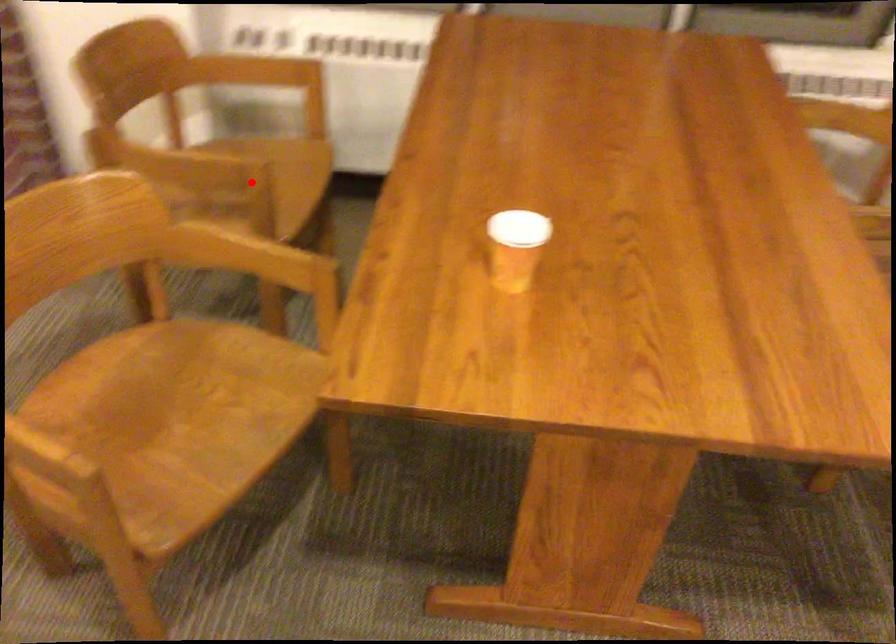
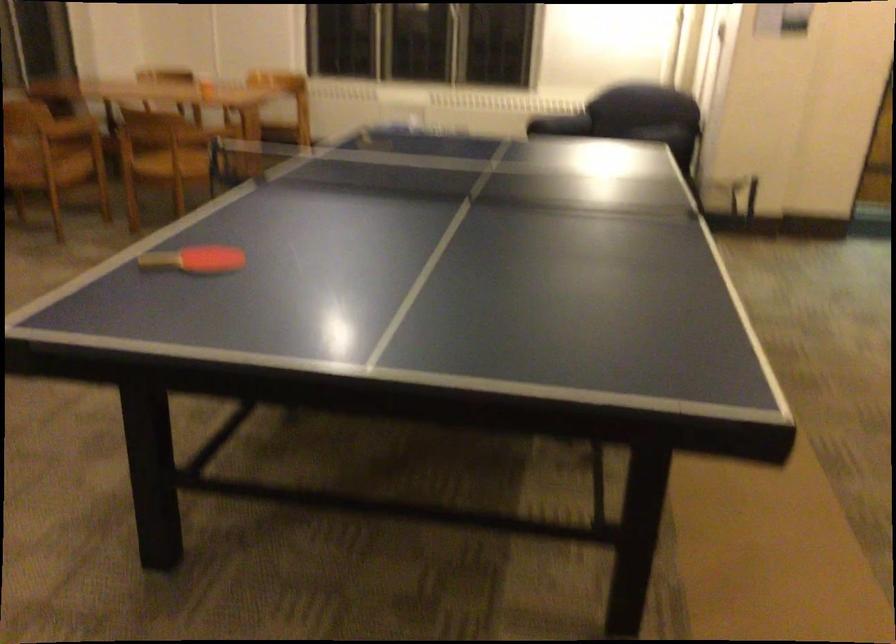
Question: I am providing you with two images of the same scene from different viewpoints. A red point is marked on the first image. Is the red point's position out of view in image 2?

Choices:
 (A) Yes
 (B) No

Answer: (A)